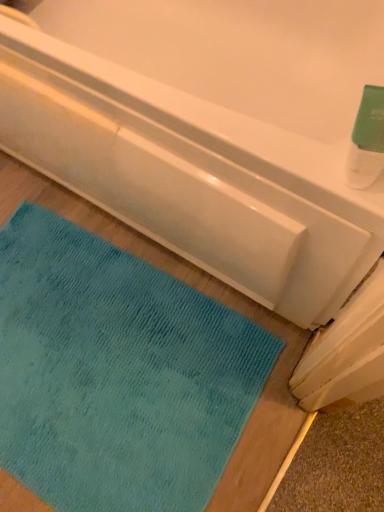
Locate an element on the screen. Image resolution: width=384 pixels, height=512 pixels. free location above teal plush mat at lower left (from a real-world perspective) is located at coordinates (92, 368).